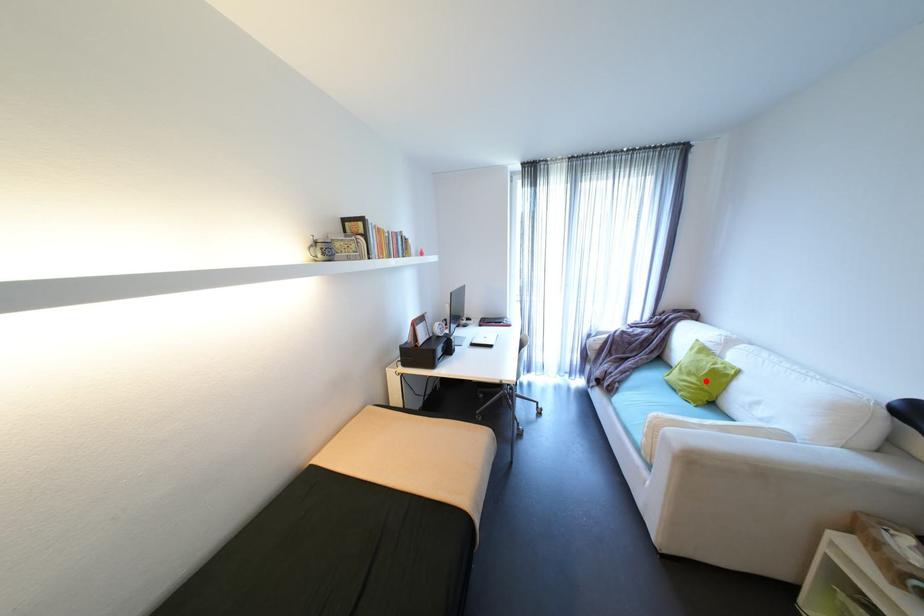
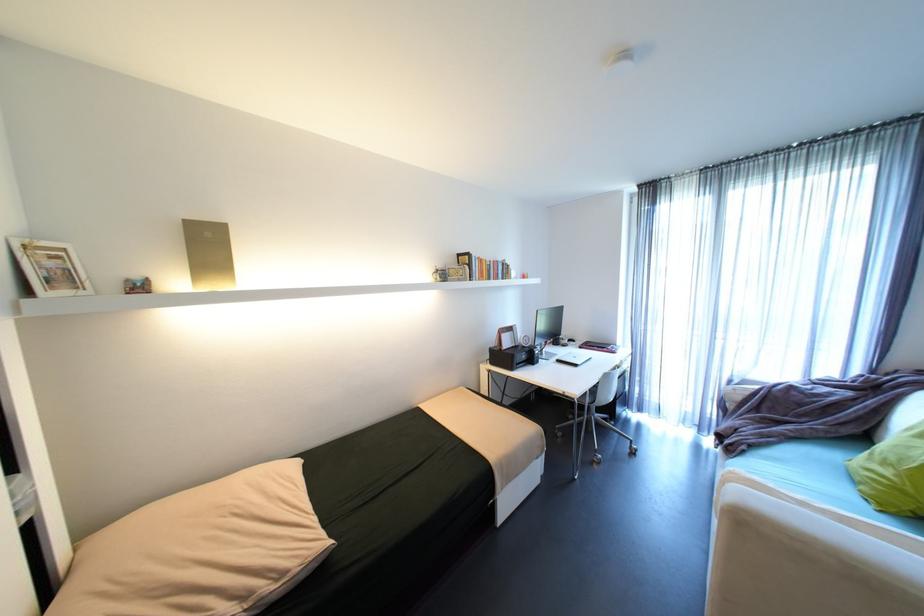
Question: I am providing you with two images of the same scene from different viewpoints. Image1 has a red point marked. In image2, the corresponding 3D location appears at what relative position? Reply with the corresponding letter.

Choices:
 (A) Closer
 (B) Farther

Answer: (B)